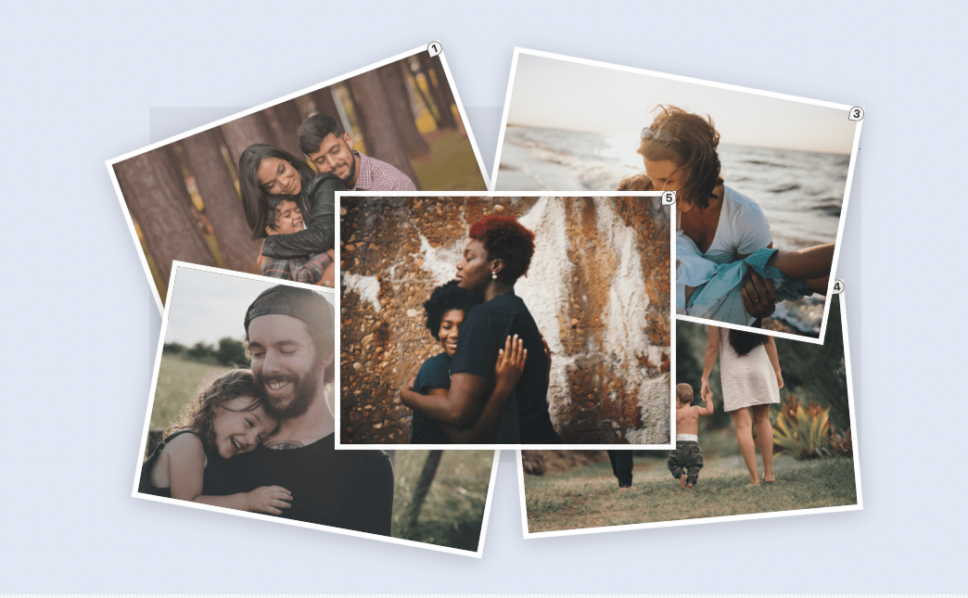
The image size is (968, 598). I want to click on photographs, so click(448, 282), click(265, 144), click(681, 146), click(727, 367), click(243, 424).